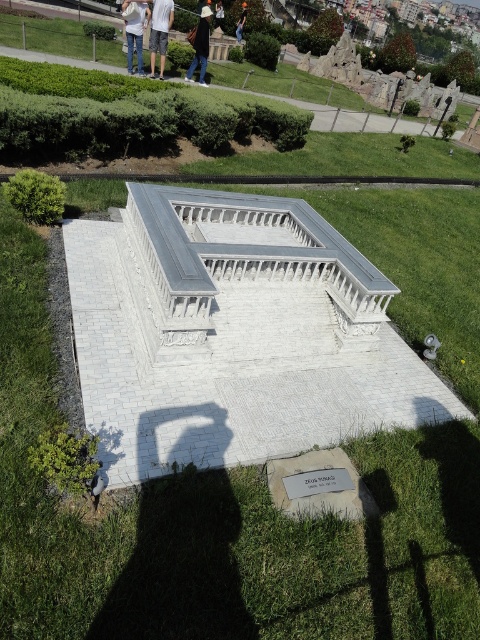
Identify the location of white cotton shorts at center. The image size is (480, 640). (159, 32).

Is white cotton shorts at center shorter than jeans at center?

Incorrect, white cotton shorts at center's height does not fall short of jeans at center's.

In order to click on white cotton shorts at center in this screenshot , I will do `click(159, 32)`.

Is jeans at center smaller than black fabric bag at upper center?

No, jeans at center is not smaller than black fabric bag at upper center.

Describe the element at coordinates (134, 33) in the screenshot. The width and height of the screenshot is (480, 640). I see `jeans at center` at that location.

Identify the location of jeans at center. The height and width of the screenshot is (640, 480). (134, 33).

Does white cotton shorts at center appear under black fabric bag at upper center?

No.

Can you confirm if white cotton shorts at center is smaller than black fabric bag at upper center?

No.

Locate an element on the screen. white cotton shorts at center is located at coordinates (159, 32).